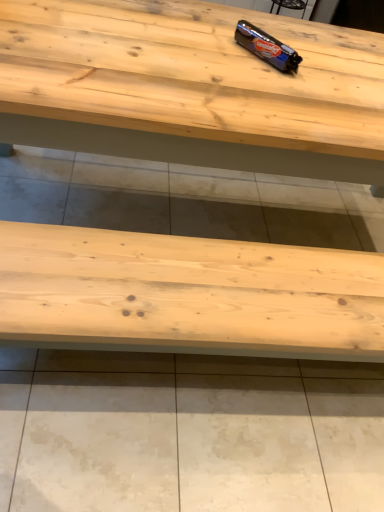
I want to click on free space to the back side of shiny metallic chocolate bar at upper center, so click(280, 33).